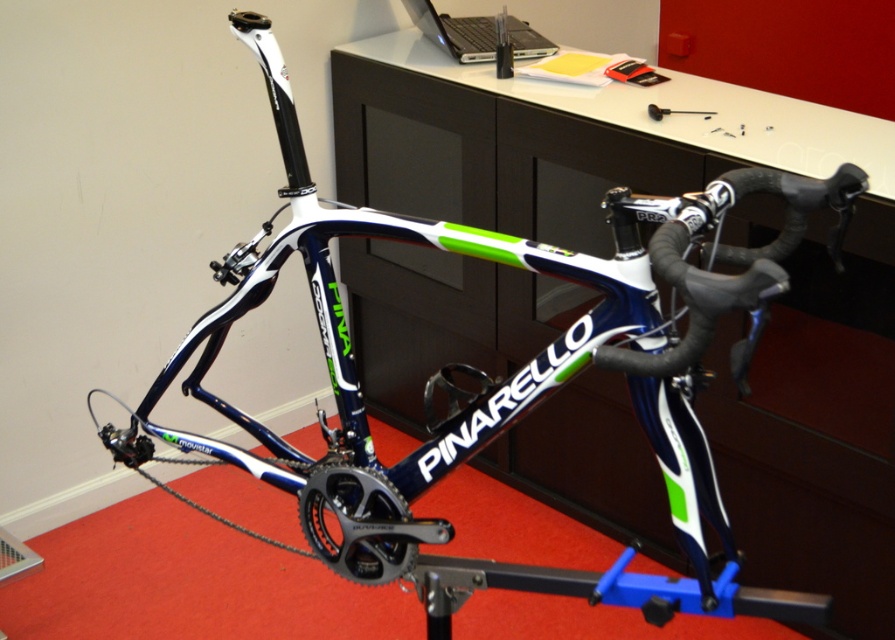
Who is higher up, black metallic gear at center or silver/black laptop at upper center?

Positioned higher is silver/black laptop at upper center.

Is point (331, 483) behind point (484, 48)?

That is False.

Is point (348, 541) positioned in front of point (533, 52)?

Yes.

The image size is (895, 640). Find the location of `black metallic gear at center`. black metallic gear at center is located at coordinates (360, 524).